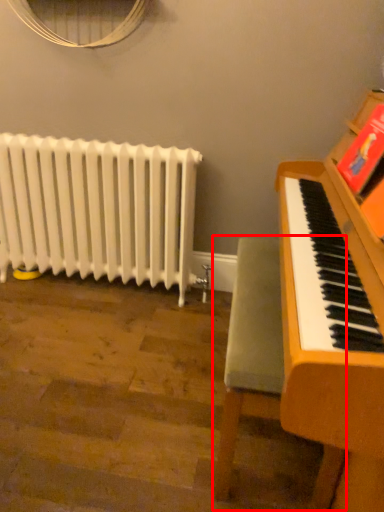
Question: From the image's perspective, considering the relative positions of armchair (annotated by the red box) and radiator in the image provided, where is armchair (annotated by the red box) located with respect to the staircase?

Choices:
 (A) below
 (B) above

Answer: (A)